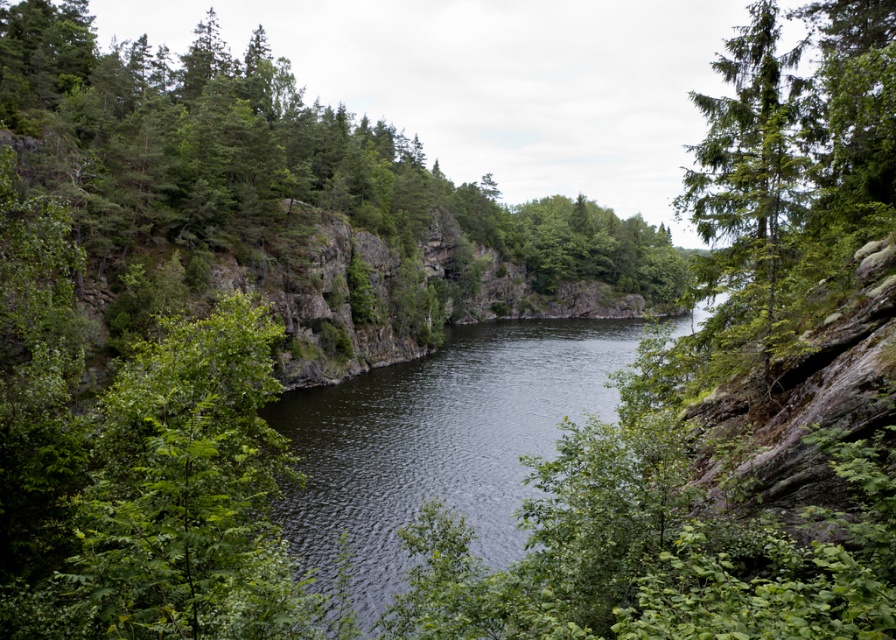
You are standing at the point labeled as point (x=438, y=444) in the image. What is the immediate environment around this point?

The point (x=438, y=444) is located in the dark water at center.

You are a photographer planning to capture the dark water at center and the green matte tree at upper right in a single frame. Which object will occupy more space in your photo?

The dark water at center will occupy more space in the photo because it is bigger than the green matte tree at upper right according to the description.

You are a hiker trying to cross the dark water at center using a narrow wooden bridge. The green matte tree at upper right is located on the opposite bank. Can you see the tree from your current position on the bridge?

The dark water at center might be wider than green matte tree at upper right, so the tree might not be visible from the bridge due to the water width obstructing the view.